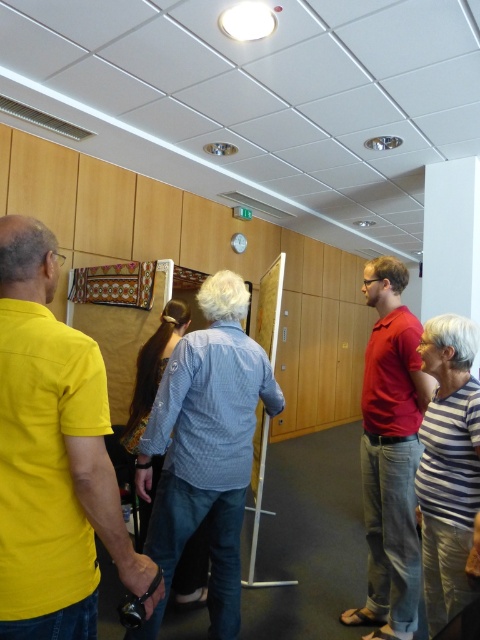
Question: Can you confirm if yellow matte shirt at left is wider than denim shirt at center?

Choices:
 (A) yes
 (B) no

Answer: (B)

Question: Is yellow matte shirt at left behind matte red shirt at center?

Choices:
 (A) yes
 (B) no

Answer: (B)

Question: Which object appears farthest from the camera in this image?

Choices:
 (A) yellow matte shirt at left
 (B) matte red shirt at center
 (C) denim shirt at center

Answer: (B)

Question: Considering the real-world distances, which object is farthest from the yellow matte shirt at left?

Choices:
 (A) denim shirt at center
 (B) matte red shirt at center

Answer: (B)

Question: Can you confirm if yellow matte shirt at left is thinner than denim shirt at center?

Choices:
 (A) no
 (B) yes

Answer: (B)

Question: Which point is closer to the camera?

Choices:
 (A) (22, 611)
 (B) (158, 611)

Answer: (A)